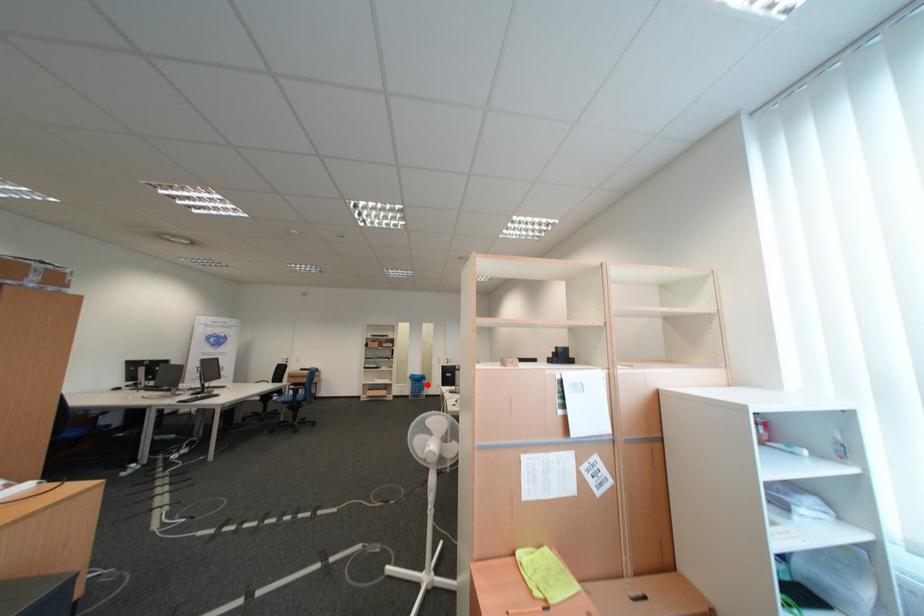
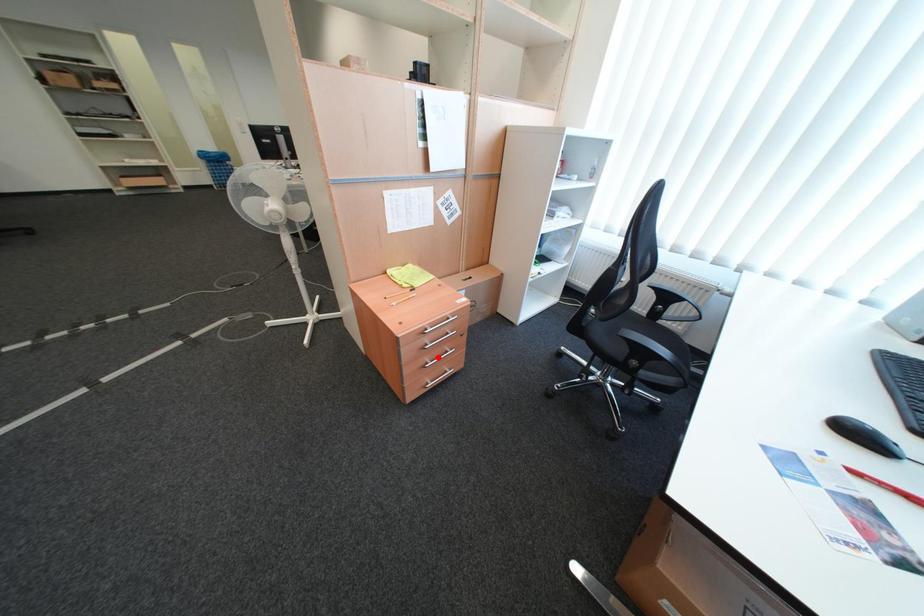
I am providing you with two images of the same scene from different viewpoints. A red point is marked on the first image and another point is marked on the second image. Are the points marked in image1 and image2 representing the same 3D position?

No